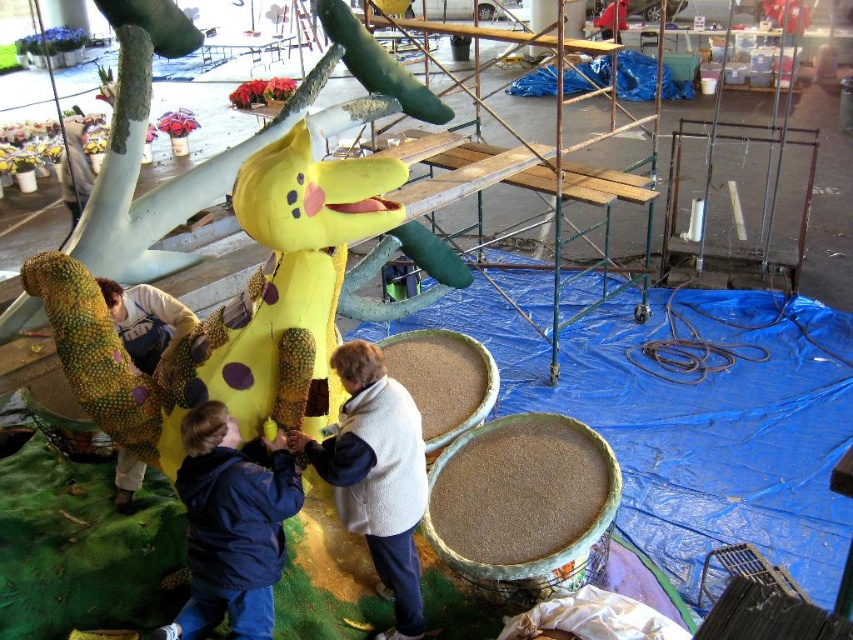
You are a visitor in the workshop and want to take a photo of the matte yellow costume at center without anyone blocking it. Considering the blue fleece jacket at lower left is in the way, can you move around to get an unobstructed view?

The blue fleece jacket at lower left is closer to the viewer than the matte yellow costume at center, so moving to the side or behind the blue fleece jacket at lower left might allow you to see the matte yellow costume at center without obstruction.

Looking at this image, you are a costume designer inspecting the workshop scene. You notice the white fleece jacket at center and the matte yellow costume at center. Which item has a greater width according to the description?

The white fleece jacket at center has a greater width than the matte yellow costume at center.

From the picture: You are a visitor in the workshop and want to take a photo of the matte yellow costume at center without including the white fleece jacket at center in the frame. Is this possible given their positions?

The white fleece jacket at center is closer to the viewer than the matte yellow costume at center, so it would block the view of the matte yellow costume at center. Therefore, it is not possible to take a photo of the matte yellow costume at center without including the white fleece jacket at center in the frame.